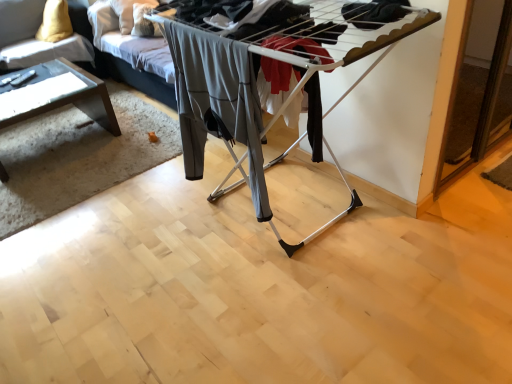
Question: In the image, is velvet yellow pillow at upper left on the left side or the right side of clear glass table at left?

Choices:
 (A) right
 (B) left

Answer: (B)

Question: From a real-world perspective, is velvet yellow pillow at upper left above or below clear glass table at left?

Choices:
 (A) below
 (B) above

Answer: (B)

Question: Which object is the closest to the gray fabric pants at center?

Choices:
 (A) clear glass table at left
 (B) velvet yellow pillow at upper left

Answer: (A)

Question: Which object is positioned closest to the clear glass table at left?

Choices:
 (A) velvet yellow pillow at upper left
 (B) gray fabric pants at center

Answer: (A)